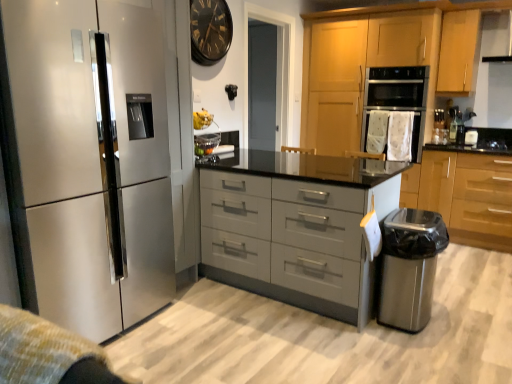
What do you see at coordinates (397, 99) in the screenshot? This screenshot has width=512, height=384. I see `white fabric oven at center` at bounding box center [397, 99].

What do you see at coordinates (471, 137) in the screenshot? This screenshot has height=384, width=512. I see `black glossy coffee machine at upper right, the first appliance in the right-to-left sequence` at bounding box center [471, 137].

Where is `satin wood cabinet at lower right, the third cabinetry in the left-to-right sequence`? satin wood cabinet at lower right, the third cabinetry in the left-to-right sequence is located at coordinates (464, 195).

Locate an element on the screen. white fabric oven at center is located at coordinates (397, 99).

Is satin silver refrigerator at left at the back of black glass clock at upper center?

No.

Where is `refrigerator in front of the black glass clock at upper center`? The image size is (512, 384). refrigerator in front of the black glass clock at upper center is located at coordinates (90, 160).

Which is behind, black glass clock at upper center or satin silver refrigerator at left?

black glass clock at upper center is further away from the camera.

Between black glass clock at upper center and satin silver refrigerator at left, which one has larger width?

With larger width is satin silver refrigerator at left.

Between point (319, 88) and point (402, 325), which one is positioned behind?

The point (319, 88) is farther from the camera.

What's the angular difference between light wood cabinet at upper right, the third cabinetry positioned from the right, and stainless steel trash can at lower right, placed as the 2th appliance when sorted from back to front,'s facing directions?

They differ by 90.9 degrees in their facing directions.

Is light wood cabinet at upper right, the third cabinetry positioned from the right, taller than stainless steel trash can at lower right, the second appliance from the right?

Indeed, light wood cabinet at upper right, the third cabinetry positioned from the right, has a greater height compared to stainless steel trash can at lower right, the second appliance from the right.

Is the surface of satin metallic refrigerator at left in direct contact with stainless steel trash can at lower right, which appears as the first appliance when viewed from the left?

No, satin metallic refrigerator at left is not next to stainless steel trash can at lower right, which appears as the first appliance when viewed from the left.

From a real-world perspective, is satin metallic refrigerator at left beneath stainless steel trash can at lower right, placed as the 2th appliance when sorted from back to front?

No, from a real-world perspective, satin metallic refrigerator at left is not below stainless steel trash can at lower right, placed as the 2th appliance when sorted from back to front.

Between satin metallic refrigerator at left and stainless steel trash can at lower right, acting as the second appliance starting from the top, which one has larger width?

stainless steel trash can at lower right, acting as the second appliance starting from the top.

Considering the positions of objects satin metallic refrigerator at left and stainless steel trash can at lower right, acting as the second appliance starting from the top, in the image provided, who is behind, satin metallic refrigerator at left or stainless steel trash can at lower right, acting as the second appliance starting from the top,?

Positioned behind is stainless steel trash can at lower right, acting as the second appliance starting from the top.

From a real-world perspective, which object stands above the other?

black glossy coffee machine at upper right, the 2th appliance when ordered from front to back, is physically above.

Which is more to the right, black glossy coffee machine at upper right, positioned as the first appliance in top-to-bottom order, or satin metallic refrigerator at left?

From the viewer's perspective, black glossy coffee machine at upper right, positioned as the first appliance in top-to-bottom order, appears more on the right side.

Is black glossy coffee machine at upper right, the 2th appliance when ordered from front to back, smaller than satin metallic refrigerator at left?

Yes.

Could you measure the distance between black glossy coffee machine at upper right, the first appliance in the right-to-left sequence, and satin metallic refrigerator at left?

black glossy coffee machine at upper right, the first appliance in the right-to-left sequence, is 4.27 meters away from satin metallic refrigerator at left.

Which point is more forward, (428, 71) or (473, 61)?

Point (473, 61)

From their relative heights in the image, would you say white fabric oven at center is taller or shorter than light wood/finished cabinet at upper right, which is the 2th cabinetry from right to left?

In the image, white fabric oven at center appears to be shorter than light wood/finished cabinet at upper right, which is the 2th cabinetry from right to left.

Is light wood/finished cabinet at upper right, which is the 2th cabinetry from right to left, at the back of white fabric oven at center?

No, light wood/finished cabinet at upper right, which is the 2th cabinetry from right to left, is not at the back of white fabric oven at center.

Is there a large distance between white fabric oven at center and light wood/finished cabinet at upper right, which is the 2th cabinetry from right to left?

No, white fabric oven at center is in close proximity to light wood/finished cabinet at upper right, which is the 2th cabinetry from right to left.

Locate an element on the screen. refrigerator beneath the light wood cabinet at upper right, the first cabinetry from the left (from a real-world perspective) is located at coordinates 90,160.

Is light wood cabinet at upper right, the third cabinetry positioned from the right, turned away from satin silver refrigerator at left?

No.

Between light wood cabinet at upper right, the third cabinetry positioned from the right, and satin silver refrigerator at left, which one has larger width?

light wood cabinet at upper right, the third cabinetry positioned from the right.

Is stainless steel trash can at lower right, the 1th appliance from the bottom, shorter than black glossy coffee machine at upper right, positioned as the first appliance in top-to-bottom order?

No, stainless steel trash can at lower right, the 1th appliance from the bottom, is not shorter than black glossy coffee machine at upper right, positioned as the first appliance in top-to-bottom order.

From a real-world perspective, is stainless steel trash can at lower right, acting as the second appliance starting from the top, located higher than black glossy coffee machine at upper right, marked as the 2th appliance in a left-to-right arrangement?

Incorrect, from a real-world perspective, stainless steel trash can at lower right, acting as the second appliance starting from the top, is lower than black glossy coffee machine at upper right, marked as the 2th appliance in a left-to-right arrangement.

Which of these two, stainless steel trash can at lower right, marked as the first appliance in a front-to-back arrangement, or black glossy coffee machine at upper right, positioned as the first appliance in top-to-bottom order, is smaller?

black glossy coffee machine at upper right, positioned as the first appliance in top-to-bottom order, is smaller.

Which of these two, stainless steel trash can at lower right, the second appliance from the right, or black glossy coffee machine at upper right, the 2th appliance when ordered from front to back, is wider?

With larger width is stainless steel trash can at lower right, the second appliance from the right.

Locate an element on the screen. This screenshot has height=384, width=512. refrigerator lying on the left of black glass clock at upper center is located at coordinates (90, 160).

From a real-world perspective, starting from the stainless steel trash can at lower right, marked as the first appliance in a front-to-back arrangement, which cabinetry is the 2nd one vertically above it? Please provide its 2D coordinates.

[(383, 59)]

Based on their spatial positions, is light wood cabinet at upper right, the first cabinetry from the left, or black glossy coffee machine at upper right, marked as the 2th appliance in a left-to-right arrangement, further from satin grey drawers at center?

black glossy coffee machine at upper right, marked as the 2th appliance in a left-to-right arrangement, is further to satin grey drawers at center.

Estimate the real-world distances between objects in this image. Which object is closer to stainless steel trash can at lower right, marked as the first appliance in a front-to-back arrangement, satin silver refrigerator at left or black glass clock at upper center?

Based on the image, satin silver refrigerator at left appears to be nearer to stainless steel trash can at lower right, marked as the first appliance in a front-to-back arrangement.

Based on their spatial positions, is stainless steel trash can at lower right, marked as the first appliance in a front-to-back arrangement, or satin silver refrigerator at left closer to light wood/finished cabinet at upper right, the second cabinetry from the left?

stainless steel trash can at lower right, marked as the first appliance in a front-to-back arrangement.

Estimate the real-world distances between objects in this image. Which object is closer to light wood/finished cabinet at upper right, the second cabinetry from the left, black glossy coffee machine at upper right, the 1th appliance when ordered from back to front, or satin metallic refrigerator at left?

Among the two, black glossy coffee machine at upper right, the 1th appliance when ordered from back to front, is located nearer to light wood/finished cabinet at upper right, the second cabinetry from the left.

Estimate the real-world distances between objects in this image. Which object is further from stainless steel trash can at lower right, placed as the 2th appliance when sorted from back to front, black glossy coffee machine at upper right, marked as the 2th appliance in a left-to-right arrangement, or light wood cabinet at upper right, the first cabinetry from the left?

black glossy coffee machine at upper right, marked as the 2th appliance in a left-to-right arrangement, lies further to stainless steel trash can at lower right, placed as the 2th appliance when sorted from back to front, than the other object.

Based on their spatial positions, is black glass clock at upper center or satin metallic refrigerator at left further from satin silver refrigerator at left?

The object further to satin silver refrigerator at left is satin metallic refrigerator at left.

Based on their spatial positions, is black glass clock at upper center or black glossy coffee machine at upper right, which is the second appliance from bottom to top, further from light wood/finished cabinet at upper right, which is the 2th cabinetry from right to left?

black glass clock at upper center is positioned further to the anchor light wood/finished cabinet at upper right, which is the 2th cabinetry from right to left.

Based on their spatial positions, is white fabric oven at center or satin wood cabinet at lower right, the third cabinetry in the left-to-right sequence, closer to satin metallic refrigerator at left?

Based on the image, satin wood cabinet at lower right, the third cabinetry in the left-to-right sequence, appears to be nearer to satin metallic refrigerator at left.

Find the location of a particular element. This screenshot has width=512, height=384. clock between satin silver refrigerator at left and stainless steel trash can at lower right, acting as the second appliance starting from the top is located at coordinates (210, 30).

Identify the location of the chest of drawers located between satin metallic refrigerator at left and light wood/finished cabinet at upper right, the second cabinetry from the left, in the depth direction. The image size is (512, 384). (295, 227).

This screenshot has width=512, height=384. I want to click on appliance between satin silver refrigerator at left and light wood cabinet at upper right, the third cabinetry positioned from the right, in the horizontal direction, so click(409, 267).

Locate an element on the screen. This screenshot has width=512, height=384. chest of drawers between satin silver refrigerator at left and light wood cabinet at upper right, the first cabinetry from the left, from left to right is located at coordinates (295, 227).